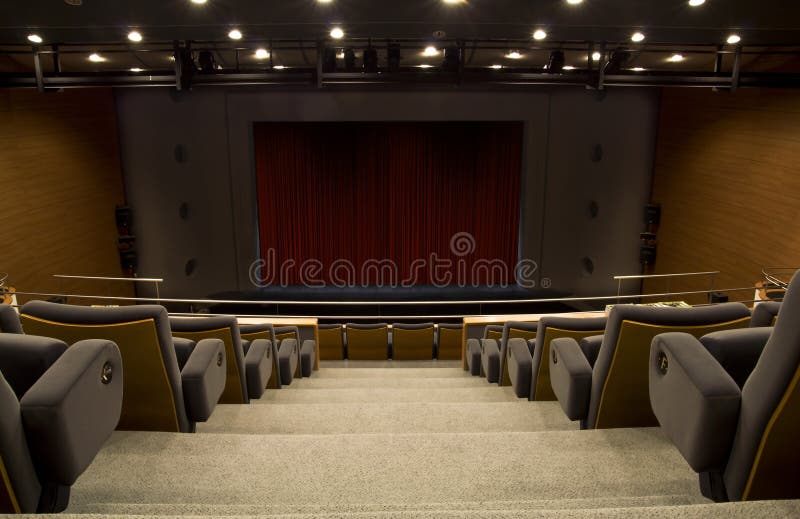
Image resolution: width=800 pixels, height=519 pixels. I want to click on arm rests on seats, so click(x=88, y=386), click(x=205, y=365), click(x=262, y=376), click(x=286, y=366), click(x=304, y=362), click(x=478, y=352), click(x=493, y=358), click(x=518, y=360), click(x=570, y=367), click(x=692, y=383).